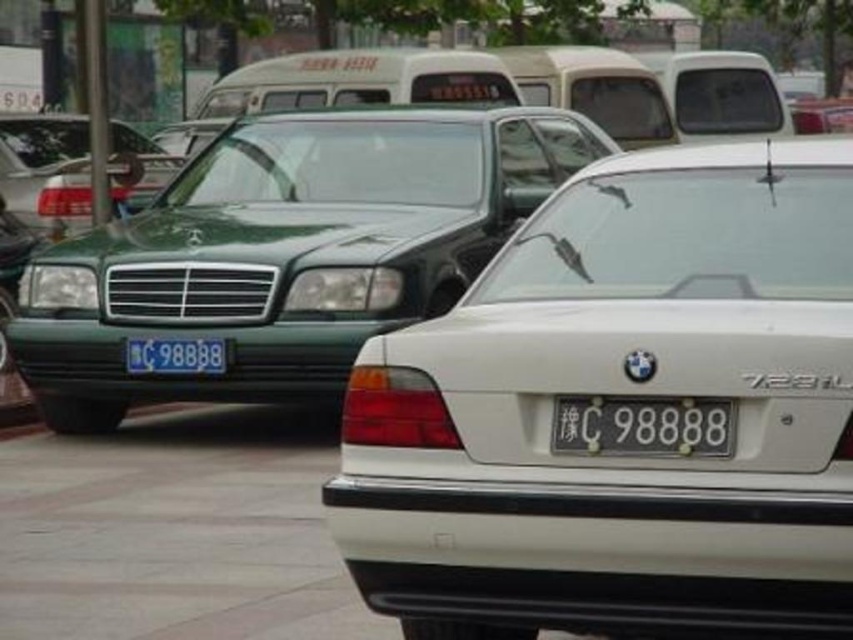
Question: Which of the following is the farthest from the observer?

Choices:
 (A) white plastic license plate at center
 (B) green matte sedan at left

Answer: (B)

Question: Does green matte sedan at left appear on the right side of white plastic license plate at center?

Choices:
 (A) yes
 (B) no

Answer: (B)

Question: Considering the real-world distances, which object is closest to the gray concrete pavement at lower center?

Choices:
 (A) white plastic license plate at center
 (B) blue metallic license plate at center

Answer: (B)

Question: Which is farther from the green matte sedan at left?

Choices:
 (A) white glossy sedan at center
 (B) white plastic license plate at center
 (C) green matte sedan at upper left

Answer: (B)

Question: Is white glossy sedan at center further to camera compared to green matte sedan at left?

Choices:
 (A) yes
 (B) no

Answer: (B)

Question: Does green matte sedan at left appear on the left side of white plastic license plate at center?

Choices:
 (A) no
 (B) yes

Answer: (B)